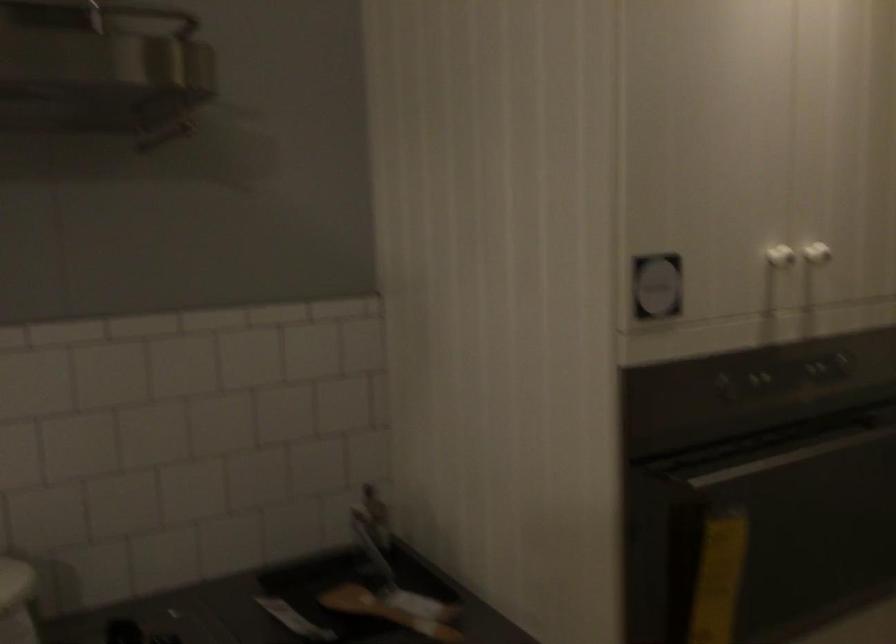
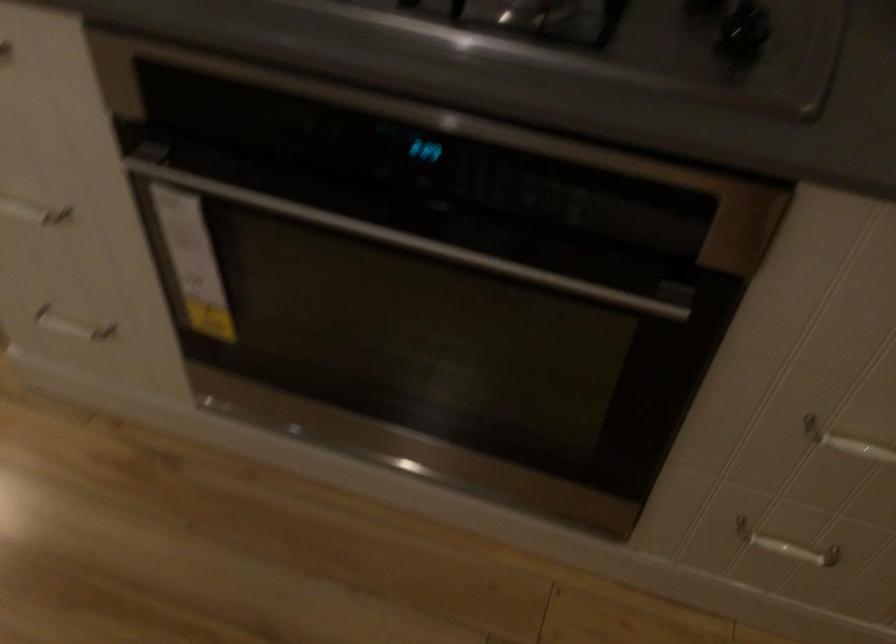
Based on the continuous images, in which direction is the camera rotating?

The camera's rotation is toward left-down.